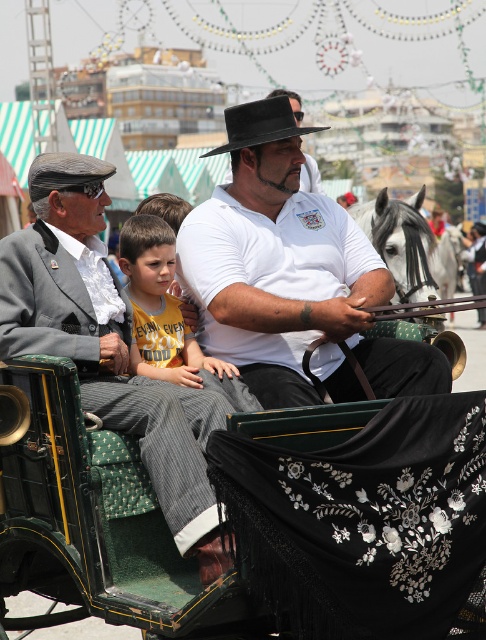
You are a photographer trying to capture a clear photo of the white matte shirt at center and the gray glossy horse at center. Since the camera can only focus on one subject at a time, which subject should you choose to ensure it takes up more of the frame?

The gray glossy horse at center occupies more space in the frame than the white matte shirt at center, so you should focus on the gray glossy horse at center to ensure it takes up more of the frame.

You are standing in front of the carriage and want to locate the white matte shirt at center. According to the scene description, where would you find it?

The white matte shirt at center is located at point (291, 275) in the image.

In the scene shown: You are a photographer trying to capture a photo of the yellow cotton shirt at center and the green fabric covered cart at center. If you want to ensure both are in focus, which object should you focus on first considering their sizes?

The yellow cotton shirt at center is smaller than the green fabric covered cart at center, so you should focus on the green fabric covered cart at center first to ensure both are in focus.